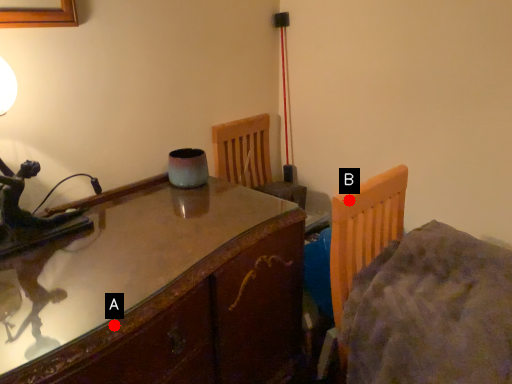
Question: Two points are circled on the image, labeled by A and B beside each circle. Among these points, which one is farthest from the camera?

Choices:
 (A) A is further
 (B) B is further

Answer: (B)